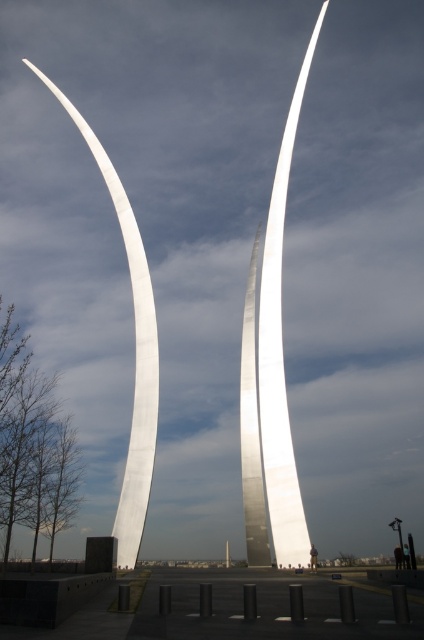
Is point (284, 129) positioned in front of point (120, 195)?

No.

Is point (278, 298) farther from camera compared to point (156, 332)?

Yes, it is.

This screenshot has height=640, width=424. I want to click on polished metal sculpture at center, so click(273, 368).